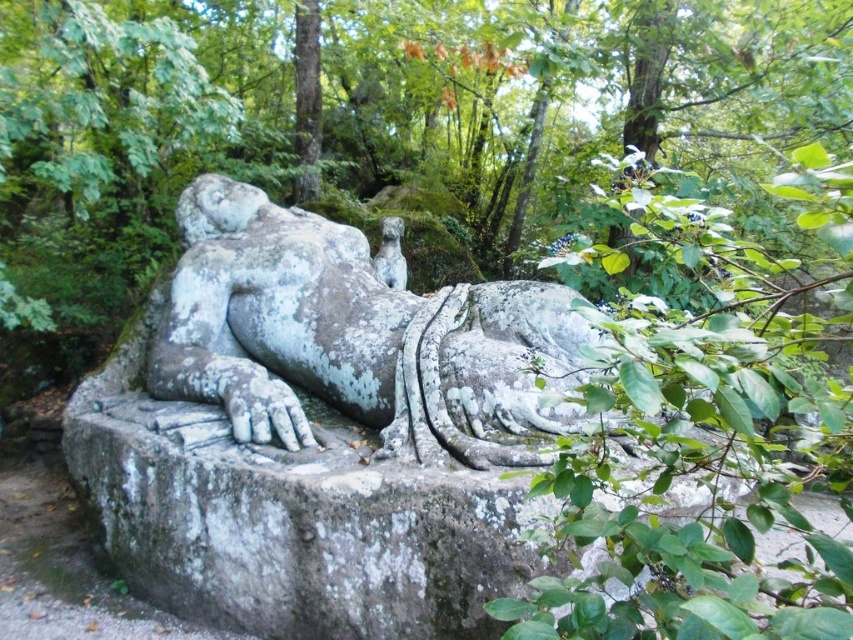
Question: Which point appears closest to the camera in this image?

Choices:
 (A) (398, 285)
 (B) (161, 358)

Answer: (B)

Question: Can you confirm if gray stone statue at center is positioned to the right of smooth gray stone face at center?

Choices:
 (A) no
 (B) yes

Answer: (A)

Question: Does gray stone statue at center appear over smooth gray stone face at center?

Choices:
 (A) no
 (B) yes

Answer: (A)

Question: Is gray stone statue at center further to camera compared to smooth gray stone face at center?

Choices:
 (A) yes
 (B) no

Answer: (B)

Question: Which point is farther to the camera?

Choices:
 (A) (393, 284)
 (B) (221, 284)

Answer: (A)